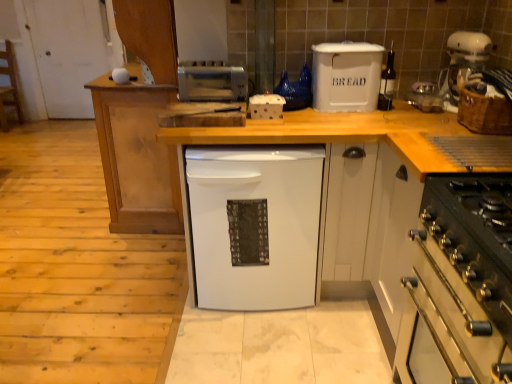
This screenshot has height=384, width=512. I want to click on vacant area in front of matte white wine bottle at center, the second appliance when ordered from right to left, so coord(393,120).